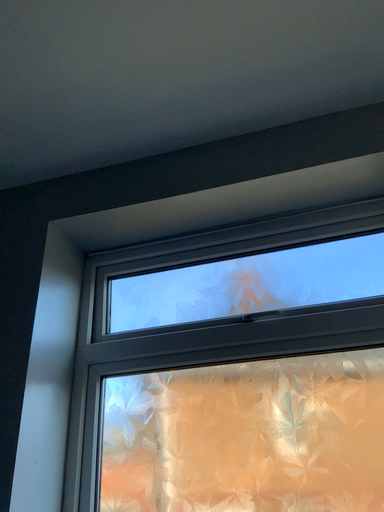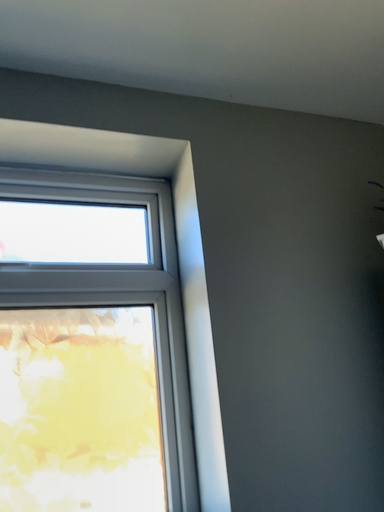
Question: How did the camera likely rotate when shooting the video?

Choices:
 (A) rotated left
 (B) rotated right

Answer: (B)